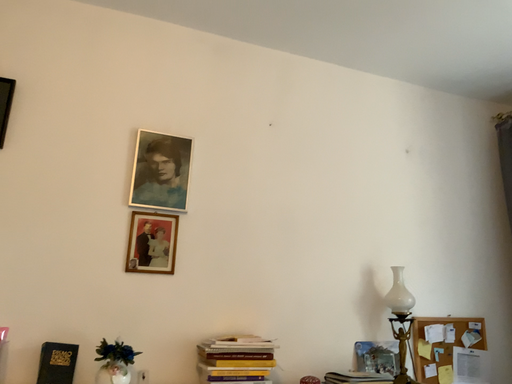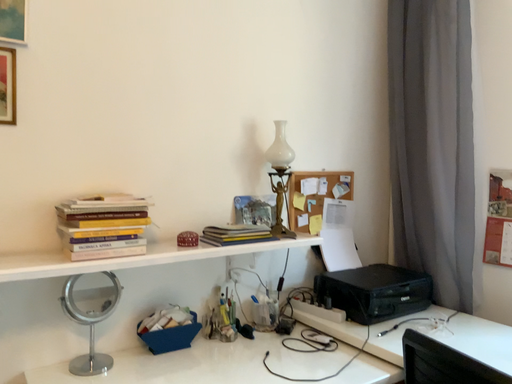
Question: Which way did the camera rotate in the video?

Choices:
 (A) rotated upward
 (B) rotated downward

Answer: (B)